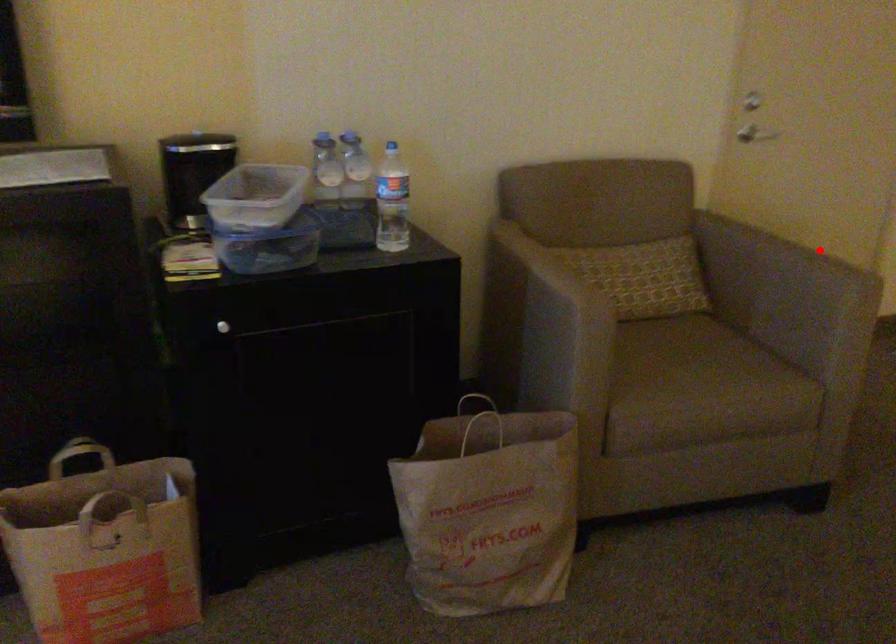
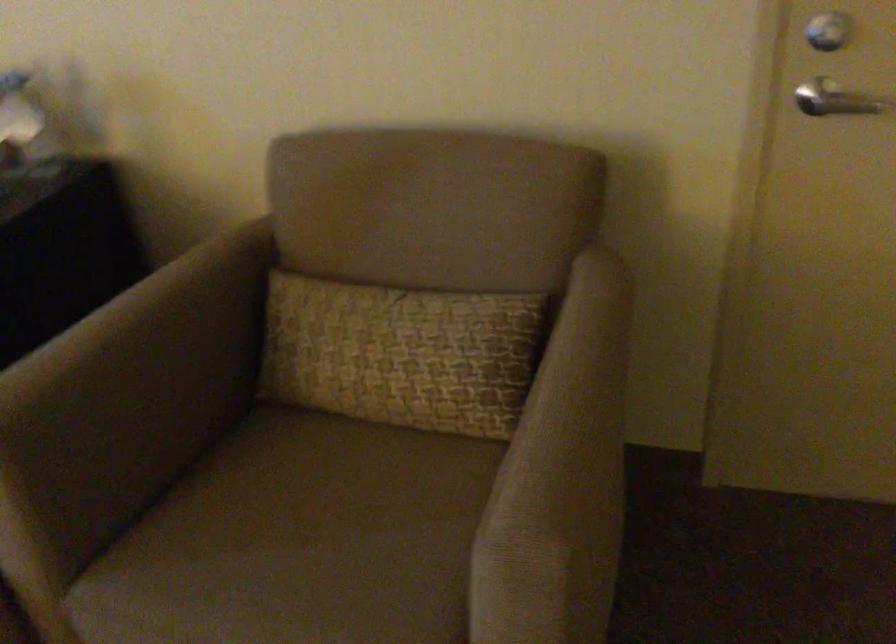
Where in the second image is the point corresponding to the highlighted location from the first image?

(581, 424)